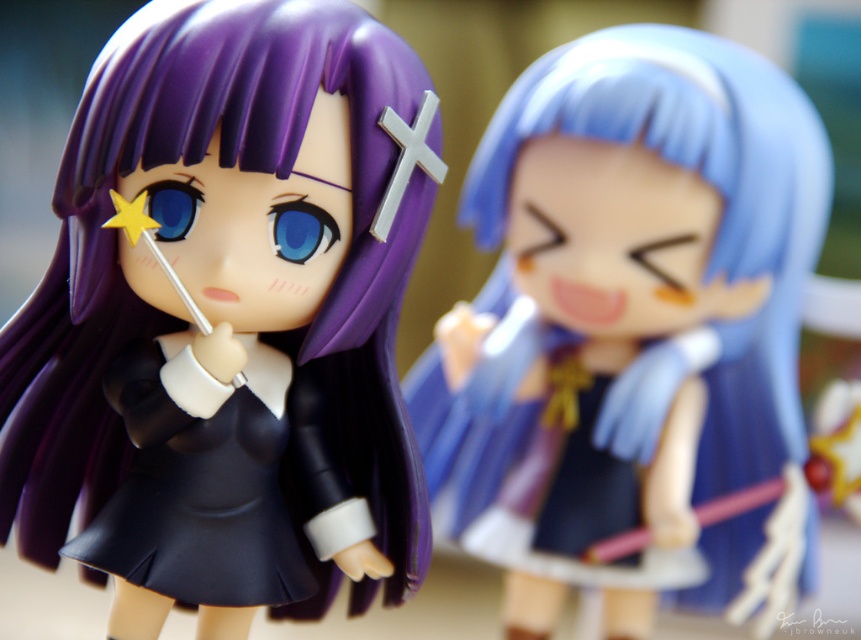
Question: Which point is farther to the camera?

Choices:
 (A) (233, 212)
 (B) (796, 392)
 (C) (224, 544)

Answer: (B)

Question: Can you confirm if matte black dress at center is wider than black matte/satin school uniform at center?

Choices:
 (A) no
 (B) yes

Answer: (B)

Question: Is matte black dress at center wider than black matte/satin school uniform at center?

Choices:
 (A) no
 (B) yes

Answer: (B)

Question: Which of the following is the farthest from the observer?

Choices:
 (A) (604, 266)
 (B) (91, 396)
 (C) (150, 582)

Answer: (A)

Question: Can you confirm if matte black dress at center is thinner than satin blue dress at right?

Choices:
 (A) no
 (B) yes

Answer: (B)

Question: Based on their relative distances, which object is farther from the matte black dress at center?

Choices:
 (A) satin blue dress at right
 (B) black matte/satin school uniform at center

Answer: (A)